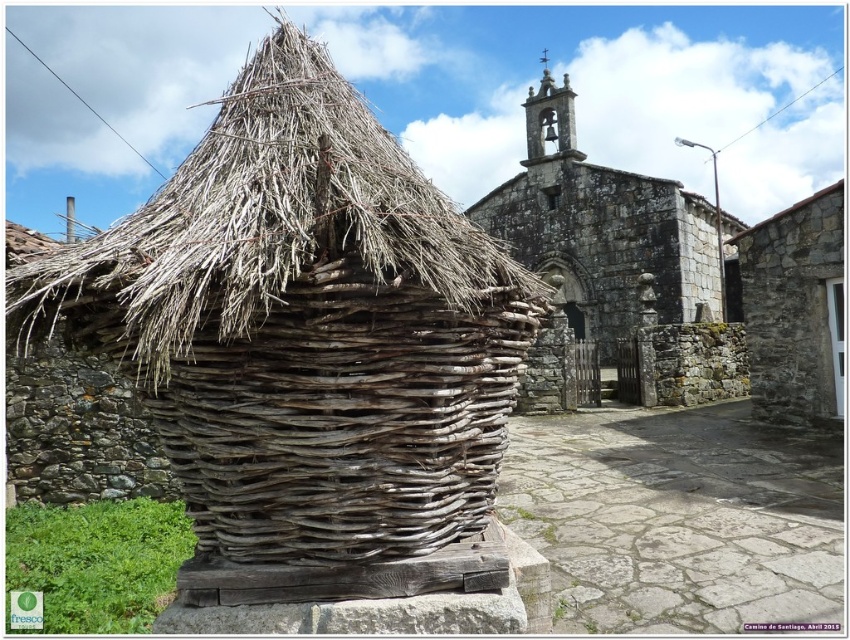
Question: Does brown woven basket at center have a smaller size compared to dry straw roof at center?

Choices:
 (A) yes
 (B) no

Answer: (A)

Question: Which object is positioned farthest from the dry straw roof at center?

Choices:
 (A) stone textured church at center
 (B) gray stone wall at right

Answer: (B)

Question: Among these objects, which one is nearest to the camera?

Choices:
 (A) dry straw roof at center
 (B) brown woven basket at center

Answer: (A)

Question: In this image, where is dry straw roof at center located relative to stone textured church at center?

Choices:
 (A) right
 (B) left

Answer: (B)

Question: Estimate the real-world distances between objects in this image. Which object is farther from the dry straw roof at center?

Choices:
 (A) gray stone wall at right
 (B) stone textured church at center
 (C) brown woven basket at center

Answer: (A)

Question: Is brown woven basket at center to the left of gray stone wall at right from the viewer's perspective?

Choices:
 (A) no
 (B) yes

Answer: (B)